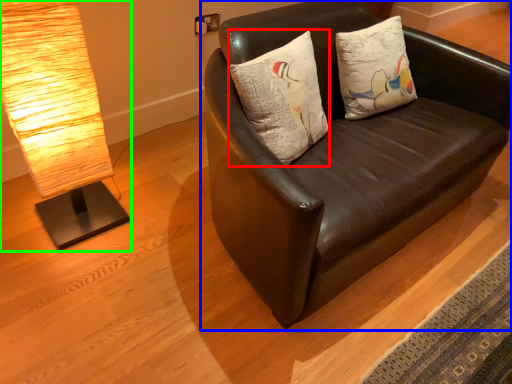
Question: Which object is the farthest from pillow (highlighted by a red box)? Choose among these: studio couch (highlighted by a blue box) or lamp (highlighted by a green box).

Choices:
 (A) studio couch
 (B) lamp

Answer: (B)